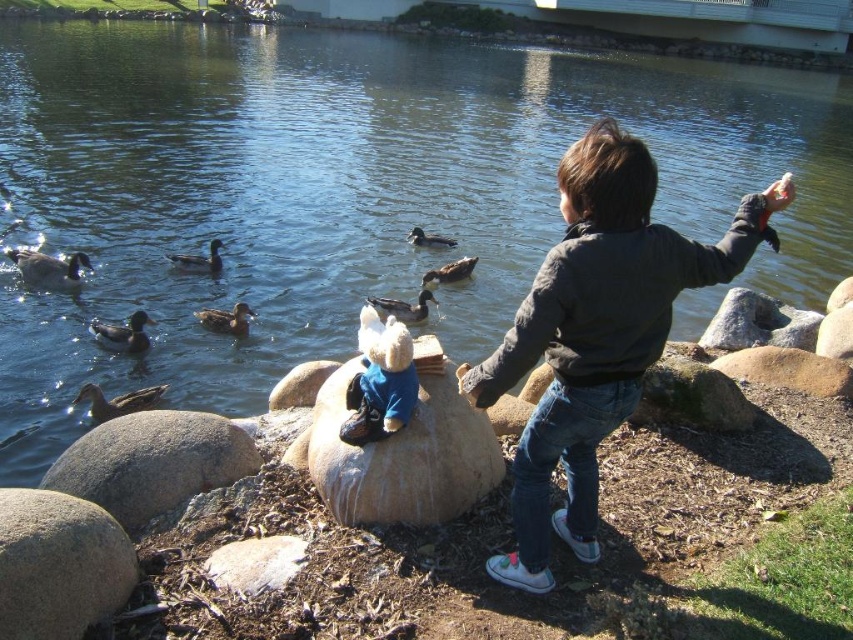
Question: Among these points, which one is farthest from the camera?

Choices:
 (A) (788, 376)
 (B) (231, 310)

Answer: (B)

Question: Does dark gray sweater at center lie in front of gray rock at center?

Choices:
 (A) yes
 (B) no

Answer: (A)

Question: Which is farther from the brown matte duck at lower left?

Choices:
 (A) gray matte duck at left
 (B) green matte duck at center
 (C) green glossy duck at center
 (D) dark gray sweater at center

Answer: (D)

Question: Estimate the real-world distances between objects in this image. Which object is farther from the gray rock at center?

Choices:
 (A) gray smooth rock at lower left
 (B) gray matte duck at left
 (C) green glossy duck at center

Answer: (B)

Question: Can you confirm if brown rough rock at center is positioned to the right of green matte duck at center?

Choices:
 (A) yes
 (B) no

Answer: (A)

Question: Does smooth gray rock at lower left appear on the left side of gray smooth rock at lower left?

Choices:
 (A) no
 (B) yes

Answer: (B)